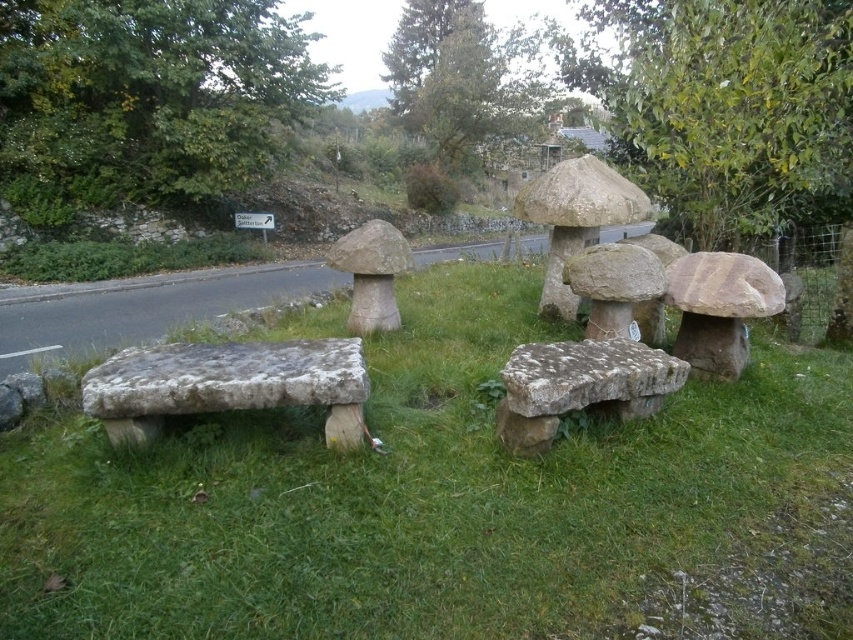
You are planning to place a small potted plant between the green mossy stone bench at center and the gray stone bench at lower left. Which bench should the plant be closer to if you want it to be near the smaller bench?

The gray stone bench at lower left is smaller, so the plant should be placed closer to it to be near the smaller bench.

You are a gardener planning to water the green mossy stone bench at center and the gray stone bench at lower left. Since both benches are made of stone, you need to check their positions. Which bench is located above the other?

The green mossy stone bench at center is positioned under the gray stone bench at lower left, so the gray stone bench at lower left is above the green mossy stone bench at center.

You are planning to place a 1.5 meter wide flower pot between the green mossy stone bench at center and the speckled stone bench at center. Based on the scene description, will the flower pot fit between them?

The green mossy stone bench at center is wider than the speckled stone bench at center. However, the exact distance between them isn not provided in the scene description. Therefore, it is uncertain if the 1.5 meter wide flower pot will fit between them without more information about the spacing between the two benches.